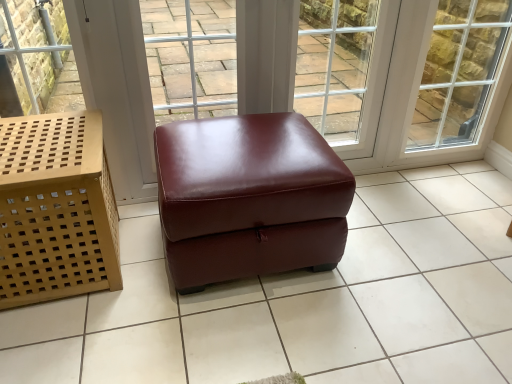
Question: In the image, is light brown woven basket at left on the left side or the right side of glossy leather ottoman at center?

Choices:
 (A) right
 (B) left

Answer: (B)

Question: Does point (94, 153) appear closer or farther from the camera than point (207, 362)?

Choices:
 (A) closer
 (B) farther

Answer: (B)

Question: Estimate the real-world distances between objects in this image. Which object is farther from the light brown woven basket at left?

Choices:
 (A) burgundy leather ottoman at center
 (B) glossy leather ottoman at center
 (C) clear glass window at upper right

Answer: (C)

Question: Which object is the farthest from the burgundy leather ottoman at center?

Choices:
 (A) light brown woven basket at left
 (B) clear glass window at upper right
 (C) glossy leather ottoman at center

Answer: (B)